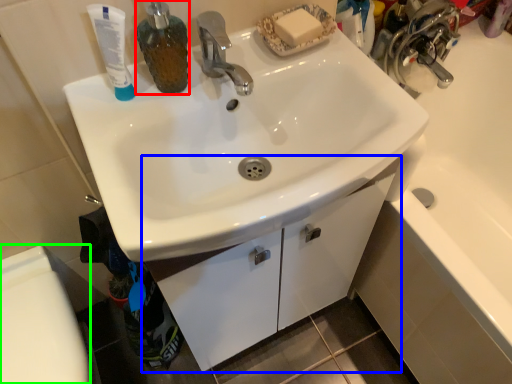
Question: Considering the real-world distances, which object is farthest from soap dispenser (highlighted by a red box)? bathroom cabinet (highlighted by a blue box) or toilet bowl (highlighted by a green box)?

Choices:
 (A) bathroom cabinet
 (B) toilet bowl

Answer: (B)